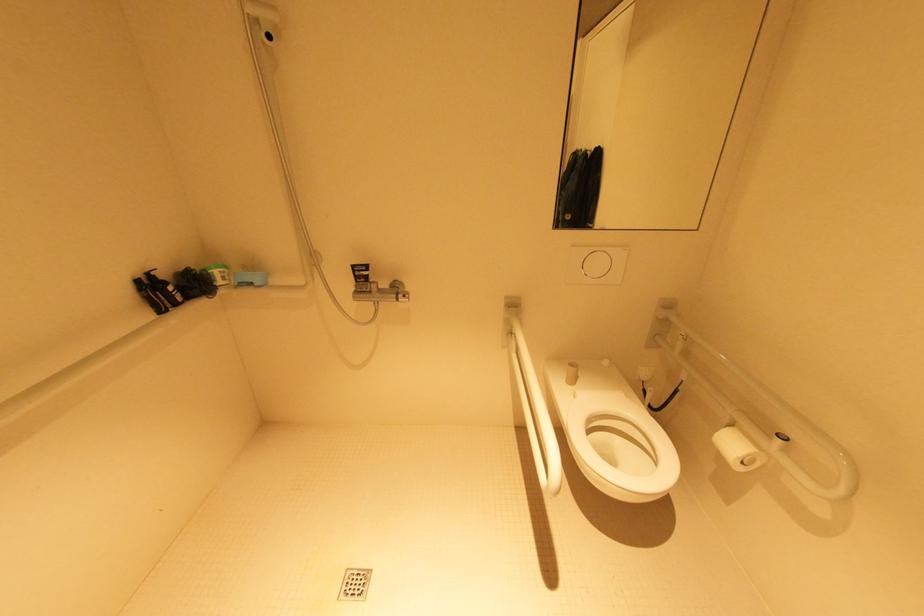
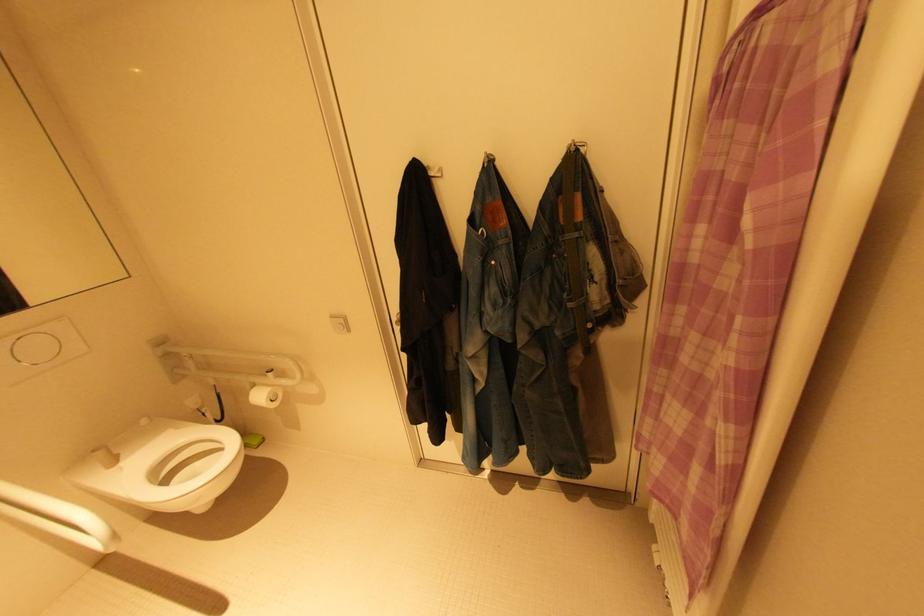
Question: The first image is from the beginning of the video and the second image is from the end. How did the camera likely rotate when shooting the video?

Choices:
 (A) Left
 (B) Right
 (C) Up
 (D) Down

Answer: (B)